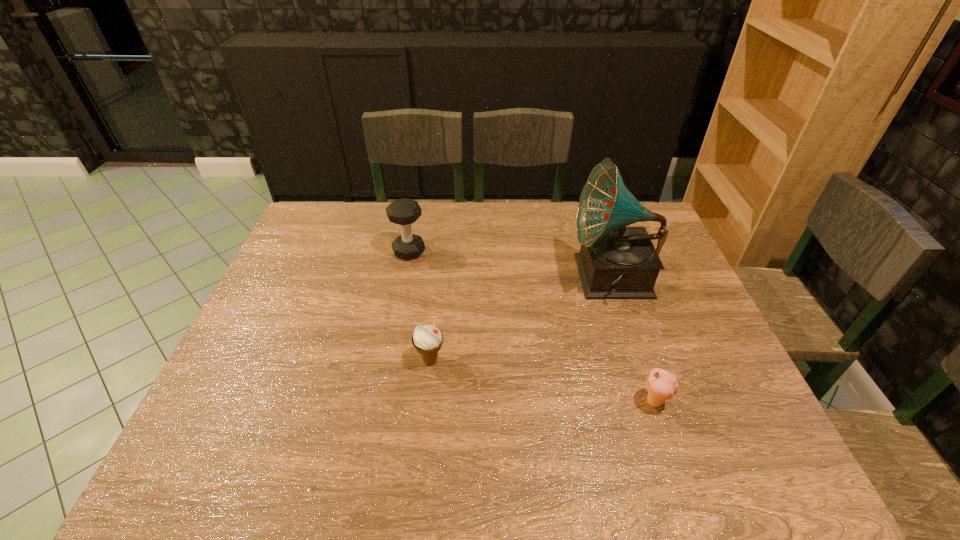
The image size is (960, 540). I want to click on vacant region located on the left of the third shortest object, so click(336, 252).

This screenshot has width=960, height=540. What are the coordinates of `free space located 0.080m on the back of the second object from left to right` in the screenshot? It's located at (434, 325).

Identify the location of blank area located on the left of the right icecream. The image size is (960, 540). (481, 402).

The image size is (960, 540). What are the coordinates of `object positioned at the far edge` in the screenshot? It's located at [404, 212].

Identify the location of object that is at the right edge. The height and width of the screenshot is (540, 960). (615, 262).

I want to click on vacant space at the far edge, so click(x=384, y=225).

Where is `vacant space at the near edge`? Image resolution: width=960 pixels, height=540 pixels. vacant space at the near edge is located at coordinates (461, 458).

In the image, there is a desktop. At what (x,y) coordinates should I click in order to perform the action: click on vacant space at the left edge. Please return your answer as a coordinate pair (x, y). This screenshot has height=540, width=960. Looking at the image, I should click on (320, 250).

You are a GUI agent. You are given a task and a screenshot of the screen. Output one action in this format:
    pyautogui.click(x=<x>, y=<y>)
    Task: Click on the vacant area at the right edge of the desktop
    The image size is (960, 540).
    Given the screenshot: What is the action you would take?
    pyautogui.click(x=674, y=288)

At what (x,y) coordinates should I click in order to perform the action: click on blank space at the far left corner of the desktop. Please return your answer as a coordinate pair (x, y). Looking at the image, I should click on (340, 211).